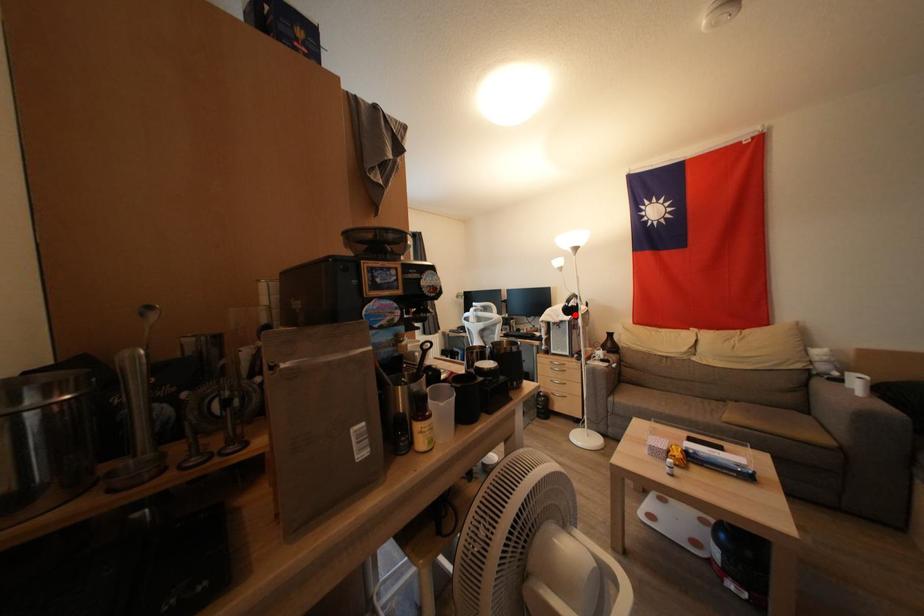
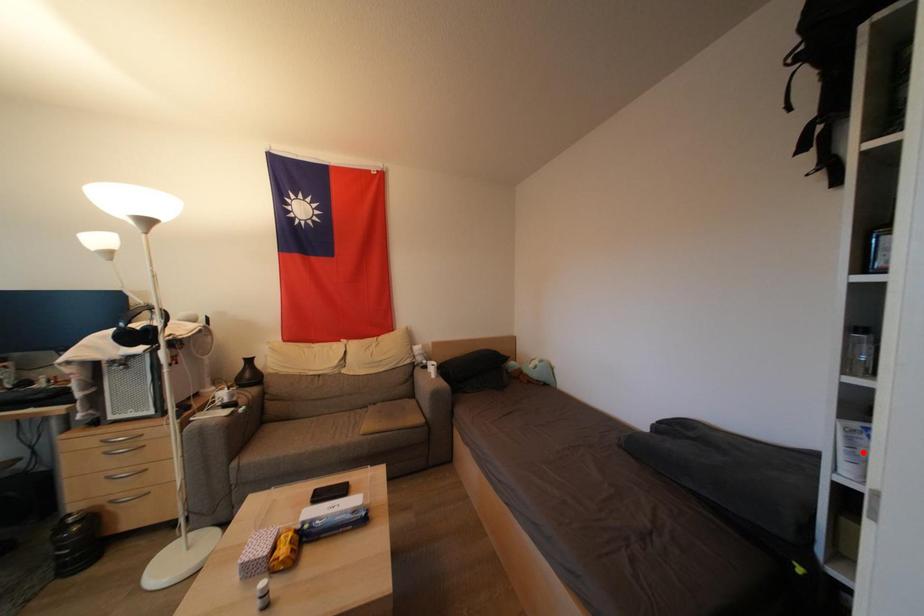
I am providing you with two images of the same scene from different viewpoints. A red point is marked on the first image and another point is marked on the second image. Are the points marked in image1 and image2 representing the same 3D position?

No